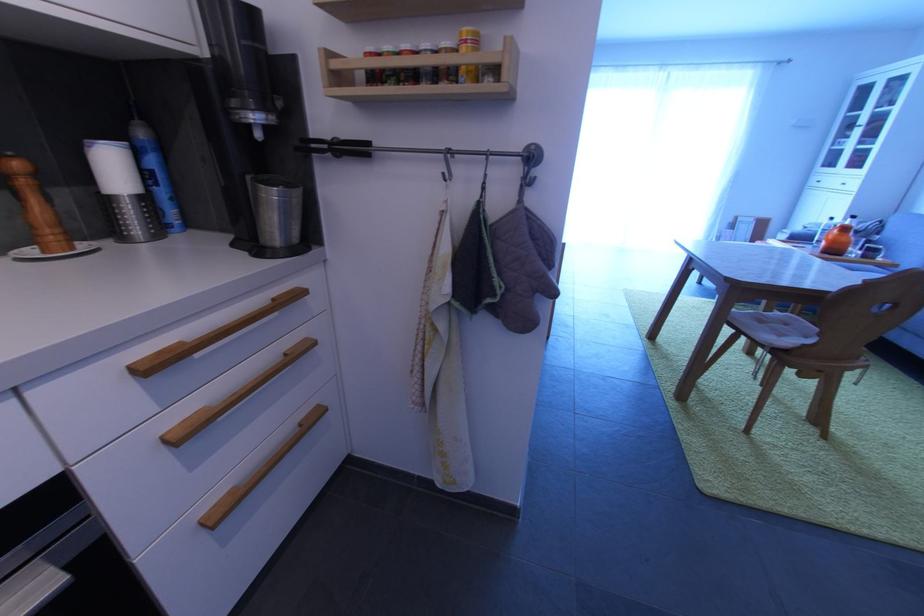
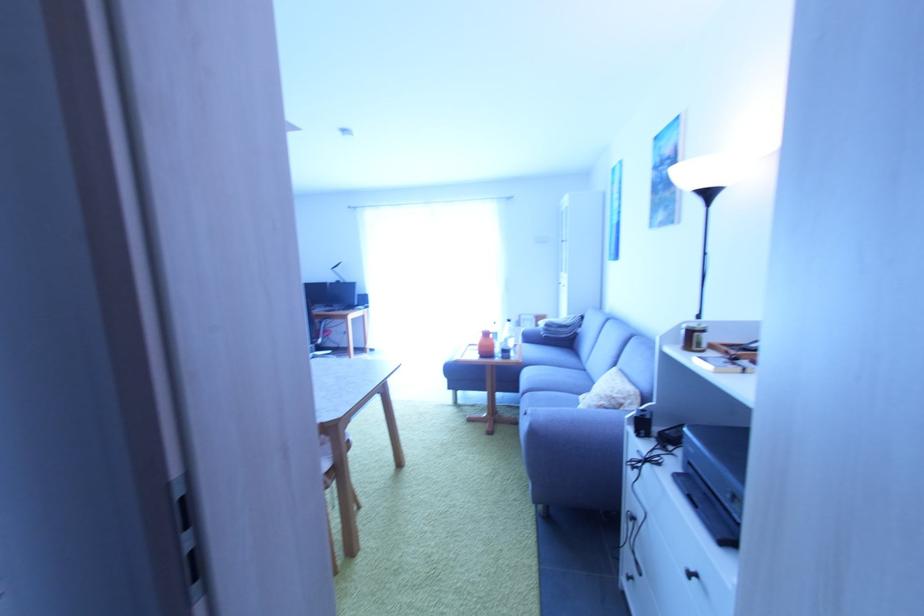
The point at (x=869, y=259) is marked in the first image. Where is the corresponding point in the second image?

(507, 360)